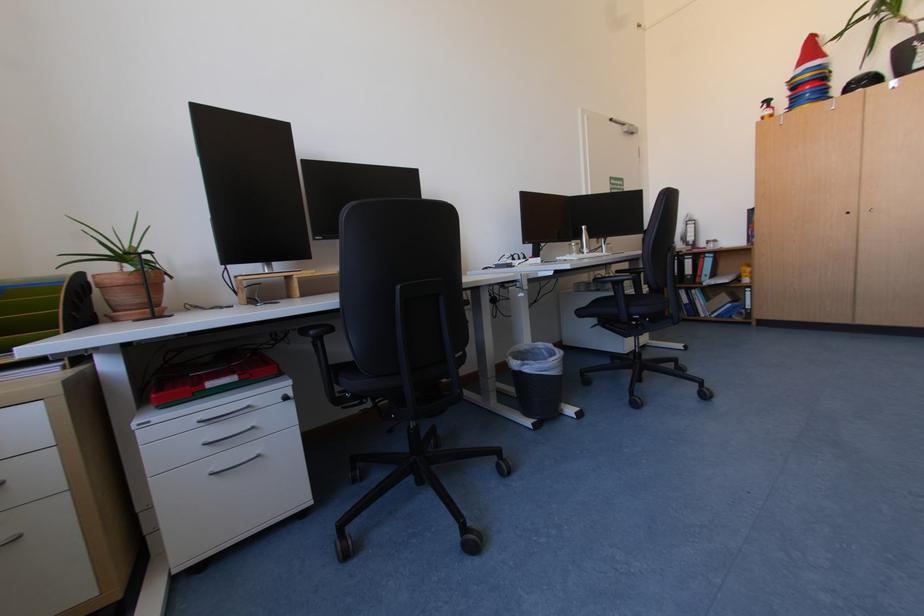
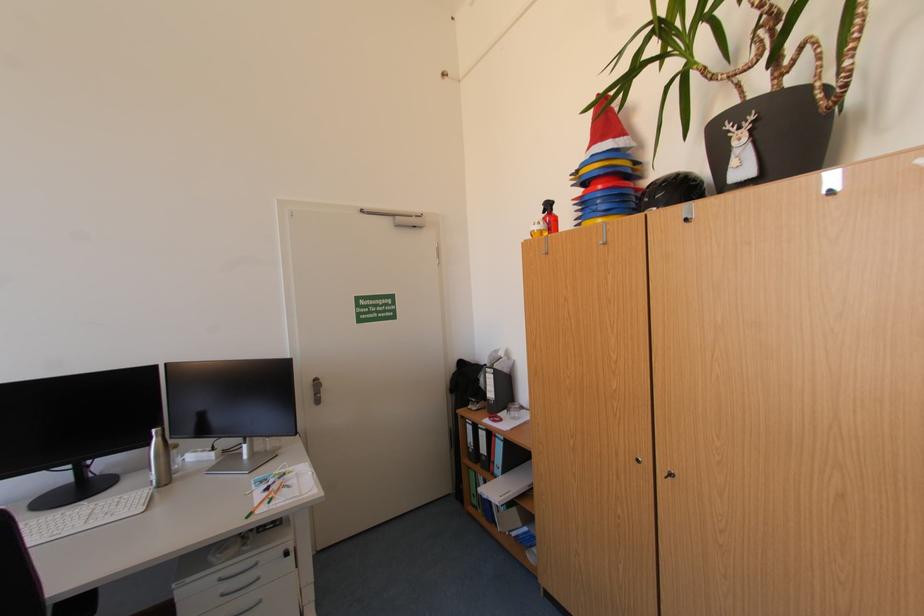
Find the pixel in the second image that matches (816,95) in the first image.

(606, 203)